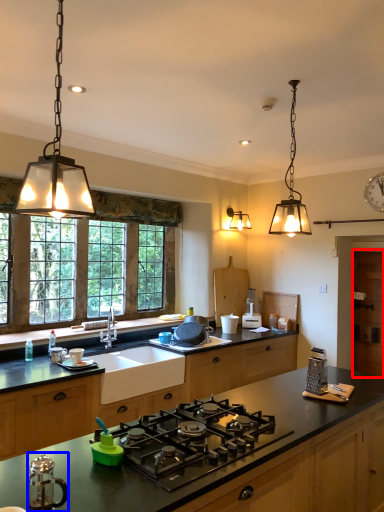
Question: Which object appears closest to the camera in this image, cabinetry (highlighted by a red box) or kitchen appliance (highlighted by a blue box)?

Choices:
 (A) cabinetry
 (B) kitchen appliance

Answer: (B)